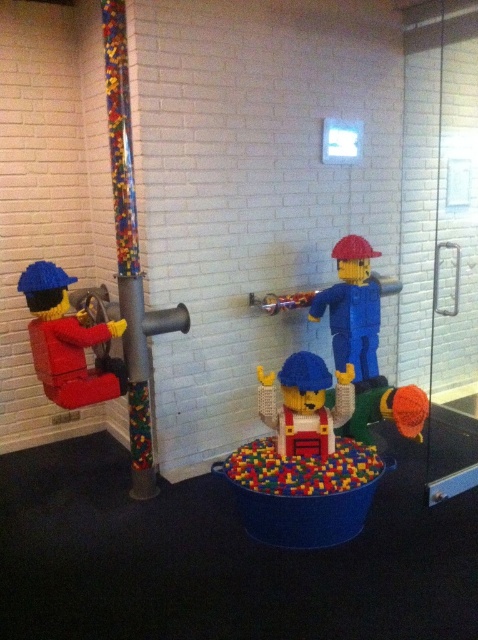
Can you confirm if matte red brick figure at left is taller than matte blue construction worker at center?

Correct, matte red brick figure at left is much taller as matte blue construction worker at center.

Who is positioned more to the left, matte red brick figure at left or matte blue construction worker at center?

Positioned to the left is matte red brick figure at left.

Is point (53, 262) positioned before point (307, 426)?

No.

I want to click on matte red brick figure at left, so click(x=65, y=339).